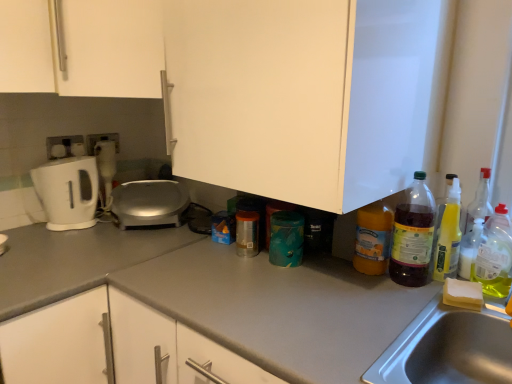
I want to click on vacant space to the left of translucent plastic spray bottle at right, the third bottle in the right-to-left sequence, so click(378, 285).